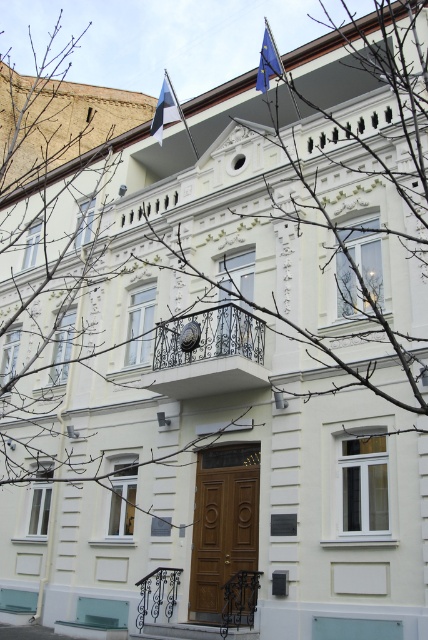
You are standing at the base of the three story building. You want to reach the point marked at point (158,116). Is the point within your immediate reach?

The distance between point (158,116) and the viewer is 187.44 feet, so the point is too far away to be reached immediately.

You are a visitor approaching the classical building and notice two flags at the top. Which flag is wider between the blue and white striped flag at upper center and the blue fabric flag at upper center?

The blue and white striped flag at upper center is wider than the blue fabric flag at upper center according to the description.